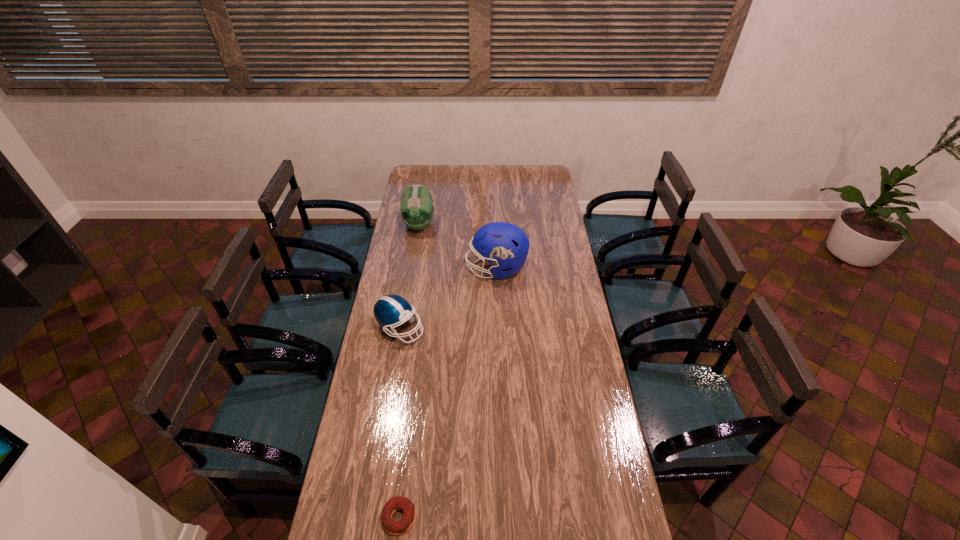
Identify the location of unoccupied area between the doughnut and the second nearest object. (399, 423).

I want to click on vacant space that is in between the nearest football helmet and the shortest object, so click(399, 423).

Where is `vacant region between the farthest football helmet and the second shortest object`? The image size is (960, 540). vacant region between the farthest football helmet and the second shortest object is located at coordinates (x=410, y=276).

This screenshot has height=540, width=960. Find the location of `vacant point located between the third farthest object and the second farthest object`. vacant point located between the third farthest object and the second farthest object is located at coordinates (448, 299).

Locate an element on the screen. free space between the second farthest object and the second nearest object is located at coordinates click(x=448, y=299).

The image size is (960, 540). What are the coordinates of `free space between the second shortest object and the second farthest object` in the screenshot? It's located at (448, 299).

Identify the location of vacant space in between the doughnut and the second shortest object. The image size is (960, 540). (399, 423).

Where is `free spot between the rightmost object and the farthest object`? The height and width of the screenshot is (540, 960). free spot between the rightmost object and the farthest object is located at coordinates (458, 247).

Locate an element on the screen. free spot between the shortest football helmet and the nearest object is located at coordinates (399, 423).

Identify the location of the third closest object relative to the nearest object. (416, 208).